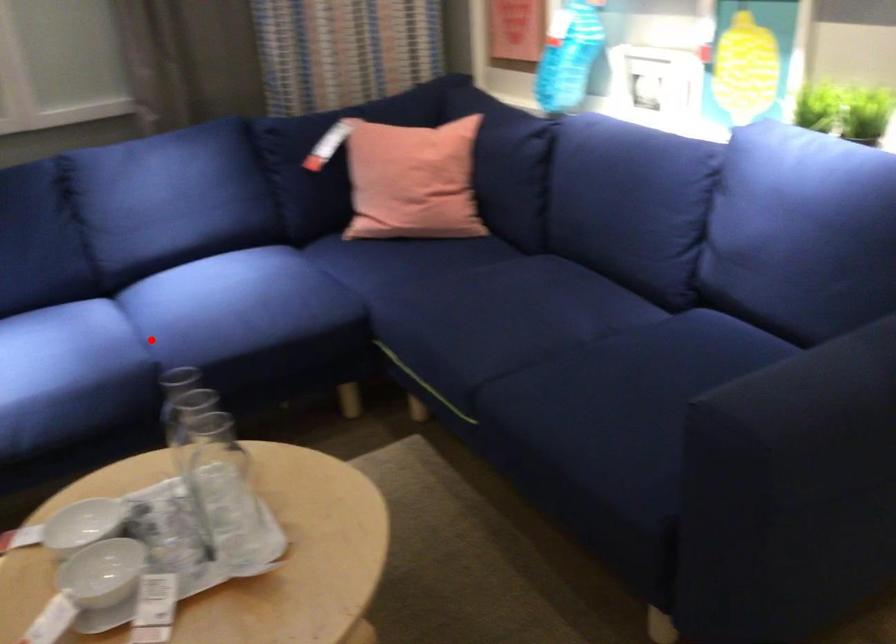
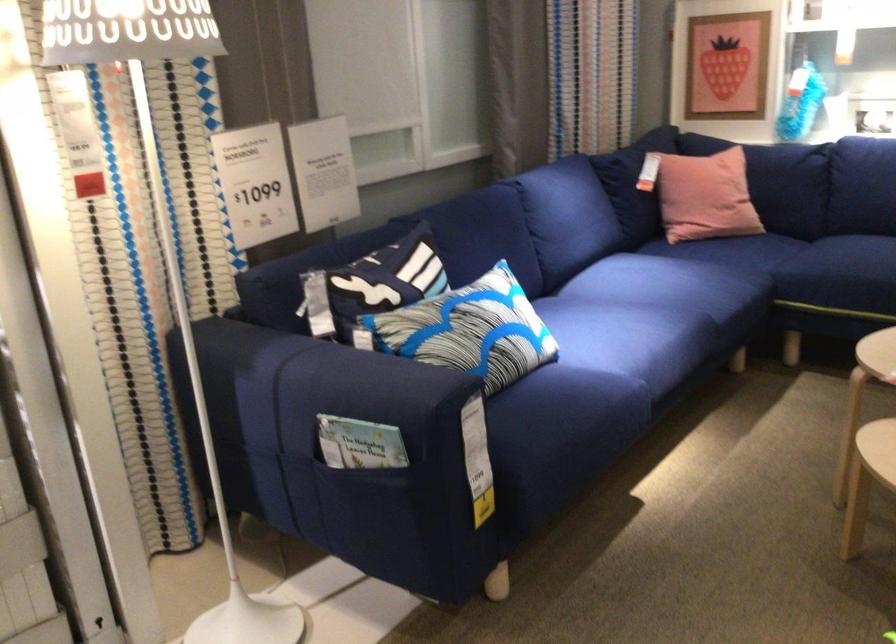
Find the pixel in the second image that matches the highlighted location in the first image.

(676, 303)